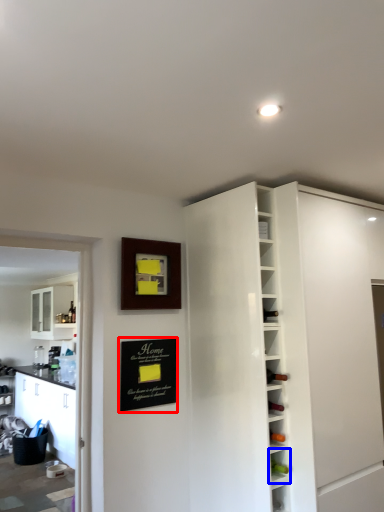
Question: Which object is further to the camera taking this photo, bulletin board (highlighted by a red box) or shelf (highlighted by a blue box)?

Choices:
 (A) bulletin board
 (B) shelf

Answer: (A)